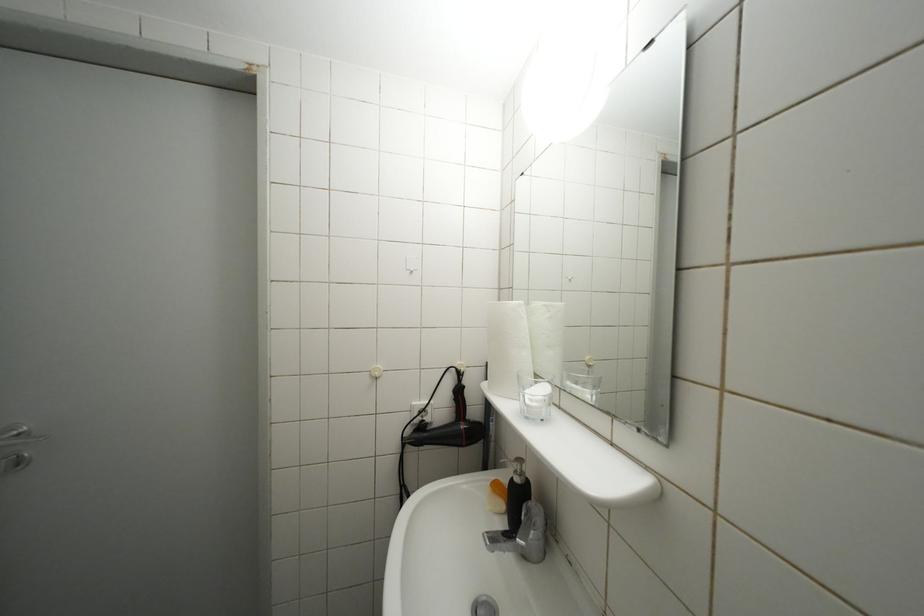
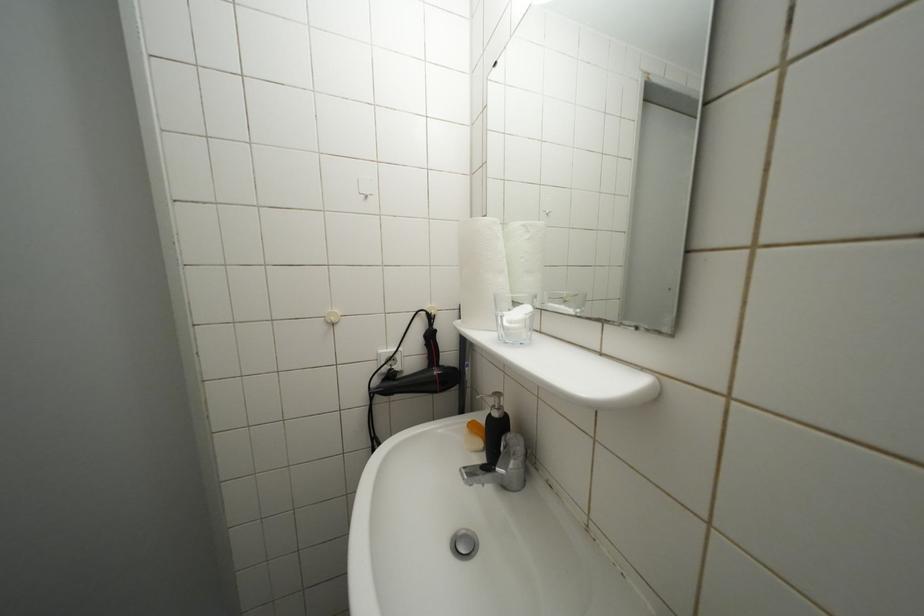
Question: The images are taken continuously from a first-person perspective. In which direction are you moving?

Choices:
 (A) Left
 (B) Right
 (C) Forward
 (D) Backward

Answer: (C)